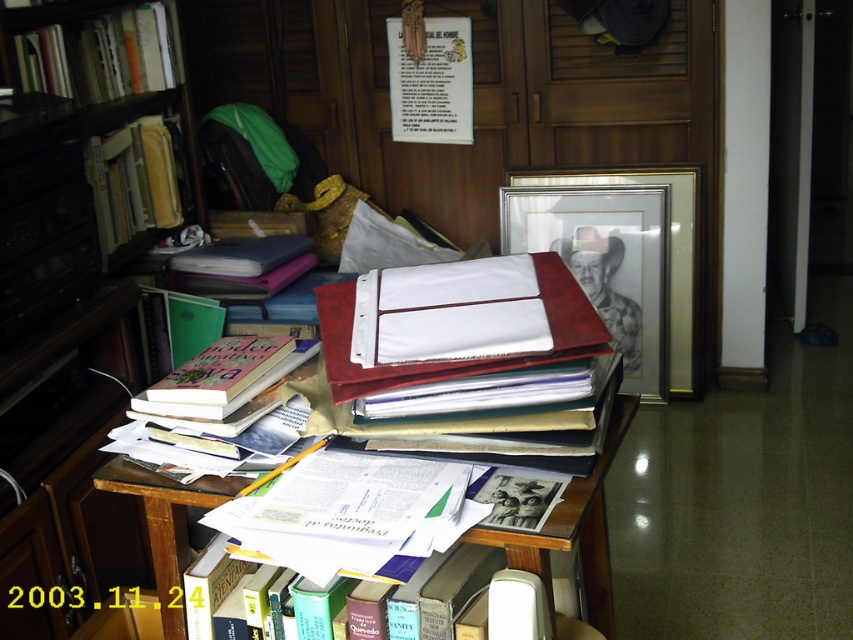
You are organizing your home office and need to move a large printer that requires 1.5 meters of space. You see the wooden bookshelf at left and the wooden desk at center. Which object can accommodate the printer due to its size?

The wooden bookshelf at left is bigger than wooden desk at center, so the wooden bookshelf at left can accommodate the printer.

You are organizing your home office and need to move a box that is 1.2 meters wide from the wooden desk at center to the wooden bookshelf at left. Can you move the box directly between them without needing to adjust the desk or bookshelf?

The distance between the wooden bookshelf at left and wooden desk at center is 1.35 meters. Since the box is 1.2 meters wide, it can fit within the space as 1.2 meters is less than 1.35 meters.